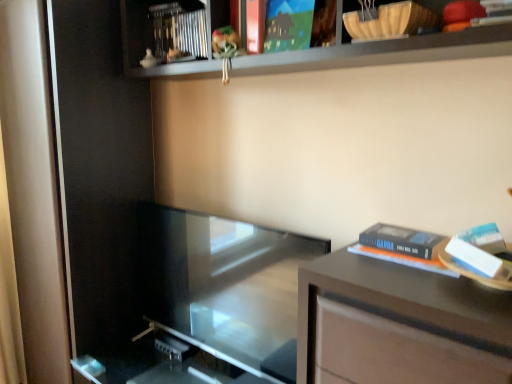
The height and width of the screenshot is (384, 512). I want to click on free location above matte brown table at right (from a real-world perspective), so click(x=406, y=276).